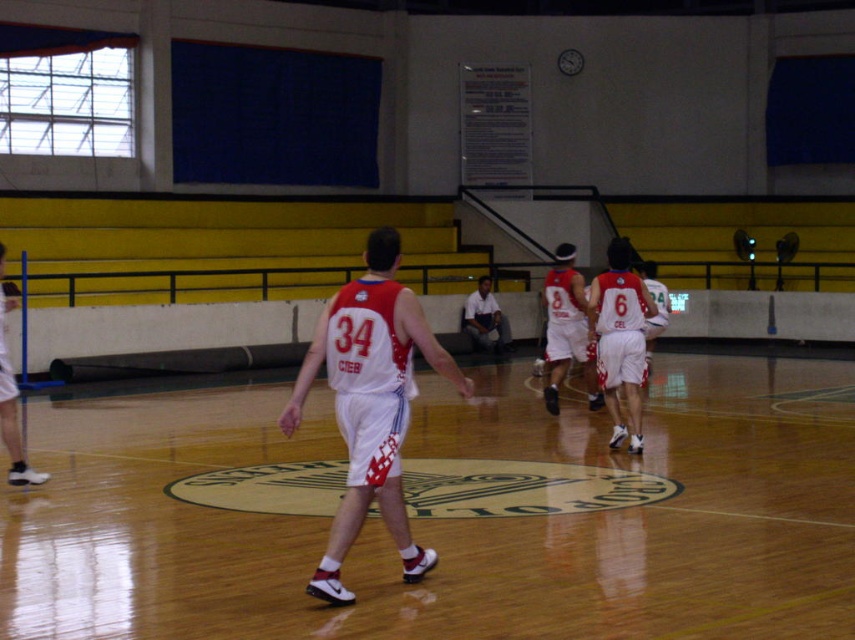
You are a photographer trying to capture a closeup of the logos on both the white matte basketball jersey at center and the white cotton shirt at center. Since you want to focus on the logos, which one should you zoom in on more to ensure the logo is clear?

The white matte basketball jersey at center has a lesser width compared to the white cotton shirt at center, so you should zoom in more on the white cotton shirt at center to ensure its logo is clear.

You are a photographer standing at the edge of the gymnasium. You want to take a photo that includes both the wooden floor at center and the white matte basketball uniform at center. Which object will appear taller in the photo?

The white matte basketball uniform at center will appear taller in the photo because the wooden floor at center is shorter than the white matte basketball uniform at center.

You are standing in the gymnasium and notice two points marked on the floor. The first point is labeled as point [567,275] and the second is point [0,408]. Which point is closer to you?

Point [567,275] is closer to you because it is further to the viewer than point [0,408].